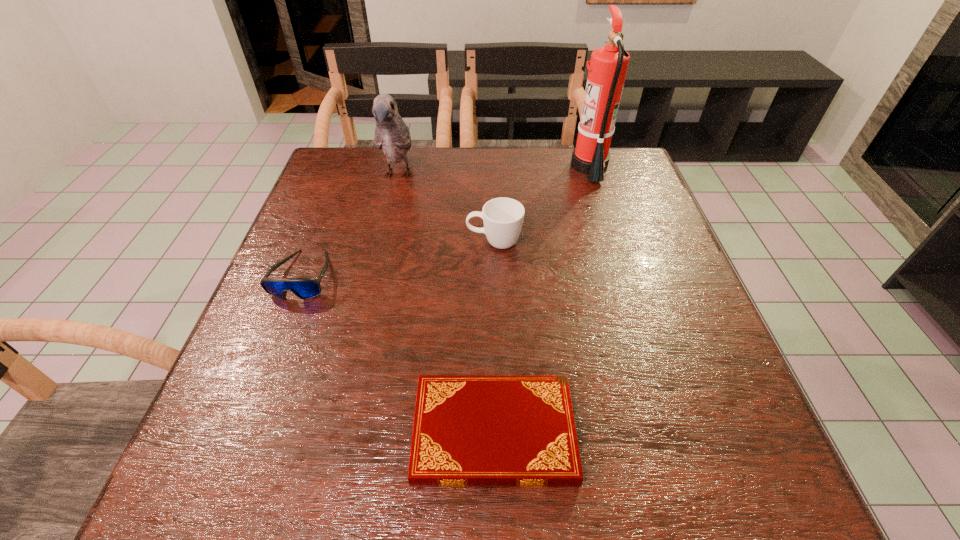
Find the location of `vacant area that lies between the parrot and the fire extinguisher`. vacant area that lies between the parrot and the fire extinguisher is located at coordinates (494, 171).

Locate an element on the screen. The image size is (960, 540). the second closest object to the hardback book is located at coordinates (503, 217).

Choose which object is the second nearest neighbor to the fire extinguisher. Please provide its 2D coordinates. Your answer should be formatted as a tuple, i.e. [(x, y)], where the tuple contains the x and y coordinates of a point satisfying the conditions above.

[(392, 135)]

Identify the location of vacant area in the image that satisfies the following two spatial constraints: 1. at the nozzle of the tallest object; 2. on the front-facing side of the leftmost object. Image resolution: width=960 pixels, height=540 pixels. (624, 275).

Identify the location of vacant region that satisfies the following two spatial constraints: 1. at the nozzle of the fire extinguisher; 2. on the front-facing side of the second tallest object. (592, 176).